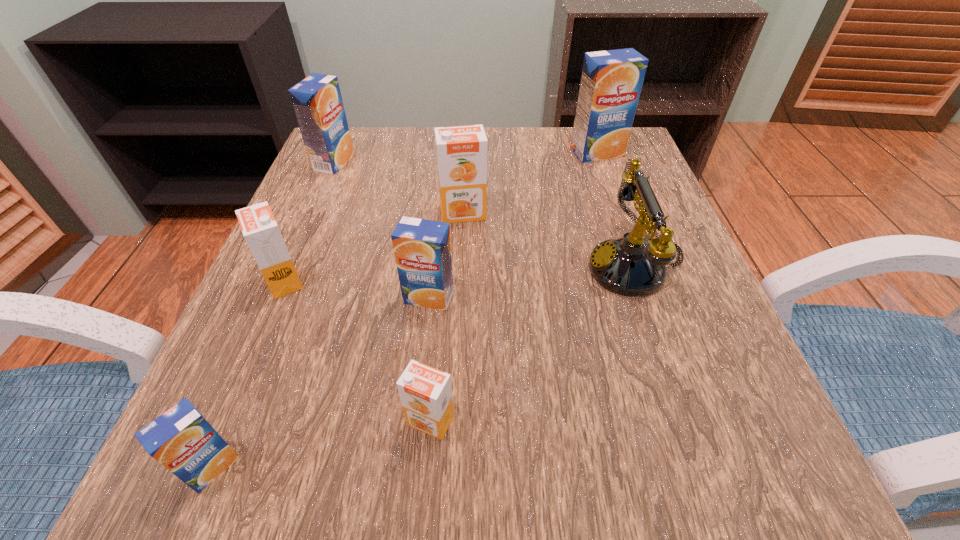
Where is `free space between the leftmost orange orange juice and the tallest orange_juice`? This screenshot has width=960, height=540. free space between the leftmost orange orange juice and the tallest orange_juice is located at coordinates (441, 217).

Image resolution: width=960 pixels, height=540 pixels. Identify the location of free space between the smallest blue orange_juice and the nearest orange orange juice. (322, 444).

Where is `object identified as the closest to the smallest blue orange_juice`? The image size is (960, 540). object identified as the closest to the smallest blue orange_juice is located at coordinates (425, 392).

Where is `object that is the fifth closest one to the third biggest blue orange_juice`? The image size is (960, 540). object that is the fifth closest one to the third biggest blue orange_juice is located at coordinates point(181,439).

Locate which orange_juice is the fourth closest to the third blue orange_juice from left to right. Please provide its 2D coordinates. Your answer should be formatted as a tuple, i.e. [(x, y)], where the tuple contains the x and y coordinates of a point satisfying the conditions above.

[(181, 439)]

Image resolution: width=960 pixels, height=540 pixels. I want to click on orange_juice that stands as the closest to the smallest orange orange juice, so click(x=422, y=249).

Where is `blue orange_juice that stands as the second closest to the farthest orange orange juice`? blue orange_juice that stands as the second closest to the farthest orange orange juice is located at coordinates (317, 101).

Locate which blue orange_juice ranks second in proximity to the smallest blue orange_juice. Please provide its 2D coordinates. Your answer should be formatted as a tuple, i.e. [(x, y)], where the tuple contains the x and y coordinates of a point satisfying the conditions above.

[(317, 101)]

This screenshot has height=540, width=960. I want to click on the second closest orange orange juice to the rightmost orange_juice, so click(x=260, y=230).

Locate an element on the screen. the closest orange orange juice to the black telephone is located at coordinates (461, 151).